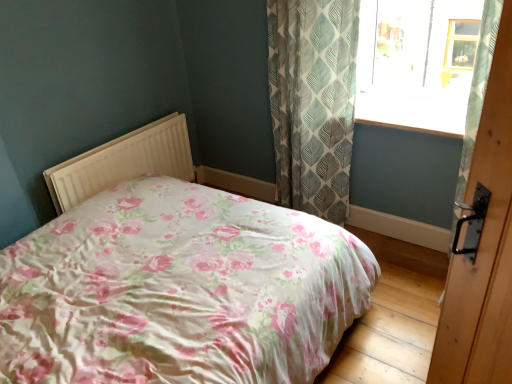
Question: Is floral fabric bed at center thinner than green leaf-patterned fabric curtain at upper right?

Choices:
 (A) no
 (B) yes

Answer: (A)

Question: Is floral fabric bed at center looking in the opposite direction of green leaf-patterned fabric curtain at upper right?

Choices:
 (A) yes
 (B) no

Answer: (B)

Question: Considering the relative positions of floral fabric bed at center and green leaf-patterned fabric curtain at upper right in the image provided, is floral fabric bed at center behind green leaf-patterned fabric curtain at upper right?

Choices:
 (A) yes
 (B) no

Answer: (B)

Question: Is floral fabric bed at center to the left of green leaf-patterned fabric curtain at upper right from the viewer's perspective?

Choices:
 (A) no
 (B) yes

Answer: (B)

Question: Can you confirm if floral fabric bed at center is bigger than green leaf-patterned fabric curtain at upper right?

Choices:
 (A) no
 (B) yes

Answer: (B)

Question: Considering the relative sizes of floral fabric bed at center and green leaf-patterned fabric curtain at upper right in the image provided, is floral fabric bed at center taller than green leaf-patterned fabric curtain at upper right?

Choices:
 (A) no
 (B) yes

Answer: (A)

Question: Is floral fabric bed at center surrounded by green leaf-patterned fabric curtain at upper right?

Choices:
 (A) yes
 (B) no

Answer: (B)

Question: Would you say green leaf-patterned fabric curtain at upper right is outside floral fabric bed at center?

Choices:
 (A) yes
 (B) no

Answer: (A)

Question: From the image's perspective, would you say green leaf-patterned fabric curtain at upper right is shown under floral fabric bed at center?

Choices:
 (A) yes
 (B) no

Answer: (B)

Question: Is green leaf-patterned fabric curtain at upper right to the left of floral fabric bed at center from the viewer's perspective?

Choices:
 (A) yes
 (B) no

Answer: (B)

Question: From a real-world perspective, is green leaf-patterned fabric curtain at upper right located beneath floral fabric bed at center?

Choices:
 (A) no
 (B) yes

Answer: (A)

Question: Is green leaf-patterned fabric curtain at upper right at the right side of floral fabric bed at center?

Choices:
 (A) no
 (B) yes

Answer: (B)

Question: Considering the relative sizes of transparent glass window at upper right and green leaf-patterned fabric curtain at upper right in the image provided, is transparent glass window at upper right smaller than green leaf-patterned fabric curtain at upper right?

Choices:
 (A) yes
 (B) no

Answer: (A)